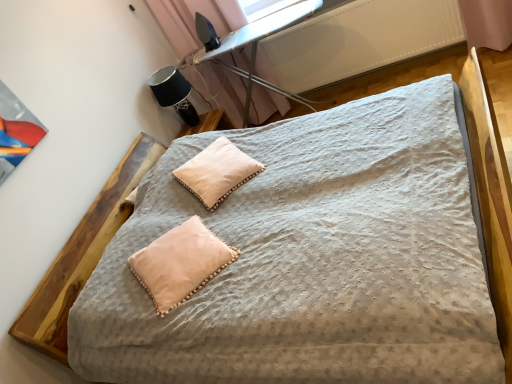
Question: Is white textured radiator at upper right not close to black fabric table lamp at upper left?

Choices:
 (A) no
 (B) yes

Answer: (B)

Question: Can you confirm if white textured radiator at upper right is positioned to the right of black fabric table lamp at upper left?

Choices:
 (A) no
 (B) yes

Answer: (B)

Question: From the image's perspective, would you say white textured radiator at upper right is shown under black fabric table lamp at upper left?

Choices:
 (A) no
 (B) yes

Answer: (A)

Question: Is white textured radiator at upper right positioned in front of black fabric table lamp at upper left?

Choices:
 (A) no
 (B) yes

Answer: (B)

Question: Is white textured radiator at upper right looking in the opposite direction of black fabric table lamp at upper left?

Choices:
 (A) no
 (B) yes

Answer: (A)

Question: Can you confirm if white textured radiator at upper right is smaller than black fabric table lamp at upper left?

Choices:
 (A) yes
 (B) no

Answer: (B)

Question: Is white soft pillow at center, which is counted as the second pillow, starting from the front, at the back of white textured radiator at upper right?

Choices:
 (A) yes
 (B) no

Answer: (B)

Question: Is white textured radiator at upper right outside of white soft pillow at center, the 1th pillow from the top?

Choices:
 (A) yes
 (B) no

Answer: (A)

Question: Could you tell me if white textured radiator at upper right is turned towards white soft pillow at center, placed as the 1th pillow when sorted from back to front?

Choices:
 (A) no
 (B) yes

Answer: (B)

Question: Considering the relative sizes of white textured radiator at upper right and white soft pillow at center, which is counted as the second pillow, starting from the front, in the image provided, is white textured radiator at upper right bigger than white soft pillow at center, which is counted as the second pillow, starting from the front,?

Choices:
 (A) yes
 (B) no

Answer: (A)

Question: From the image's perspective, is white textured radiator at upper right under white soft pillow at center, which is counted as the second pillow, starting from the front?

Choices:
 (A) yes
 (B) no

Answer: (B)

Question: Are white textured radiator at upper right and white soft pillow at center, placed as the 1th pillow when sorted from back to front, far apart?

Choices:
 (A) no
 (B) yes

Answer: (B)

Question: Is metal ironing board at upper center looking in the opposite direction of black fabric table lamp at upper left?

Choices:
 (A) yes
 (B) no

Answer: (B)